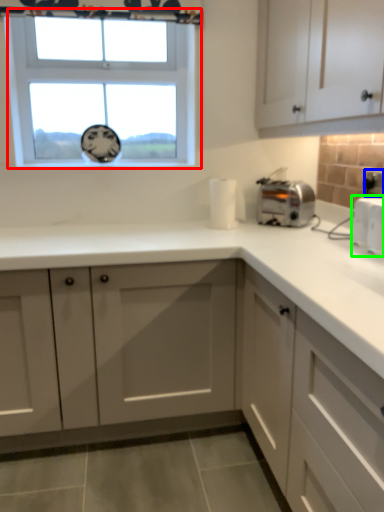
Question: Which object is positioned closest to window (highlighted by a red box)? Select from electric outlet (highlighted by a blue box) and appliance (highlighted by a green box).

Choices:
 (A) electric outlet
 (B) appliance

Answer: (B)